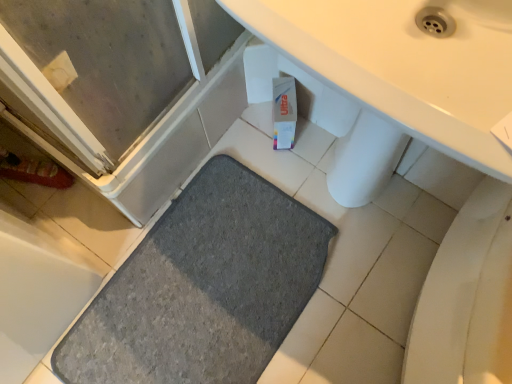
Find the location of a particular element. vacant space underneath gray carpet at lower left (from a real-world perspective) is located at coordinates (193, 297).